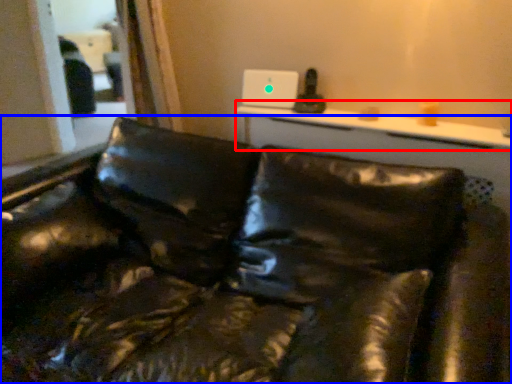
Question: Among these objects, which one is farthest to the camera, table (highlighted by a red box) or studio couch (highlighted by a blue box)?

Choices:
 (A) table
 (B) studio couch

Answer: (A)